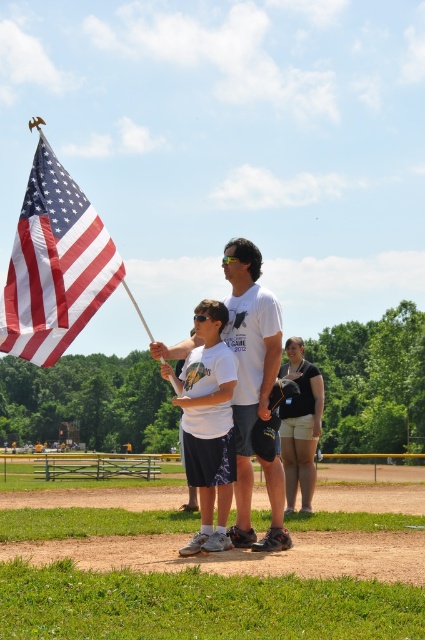
Question: Which point appears closest to the camera in this image?

Choices:
 (A) (201, 397)
 (B) (302, 436)
 (C) (88, 260)

Answer: (A)

Question: Can you confirm if white matte t-shirt at center is bigger than black fabric backpack at center?

Choices:
 (A) yes
 (B) no

Answer: (A)

Question: Is white matte shirt at center below black fabric backpack at center?

Choices:
 (A) yes
 (B) no

Answer: (B)

Question: Can you confirm if white matte t-shirt at center is smaller than black fabric backpack at center?

Choices:
 (A) yes
 (B) no

Answer: (B)

Question: Which point appears closest to the camera in this image?

Choices:
 (A) (297, 340)
 (B) (65, 288)
 (C) (257, 340)

Answer: (B)

Question: Which point is closer to the camera?

Choices:
 (A) (305, 492)
 (B) (87, 211)
 (C) (254, 268)
 (D) (206, 416)

Answer: (D)